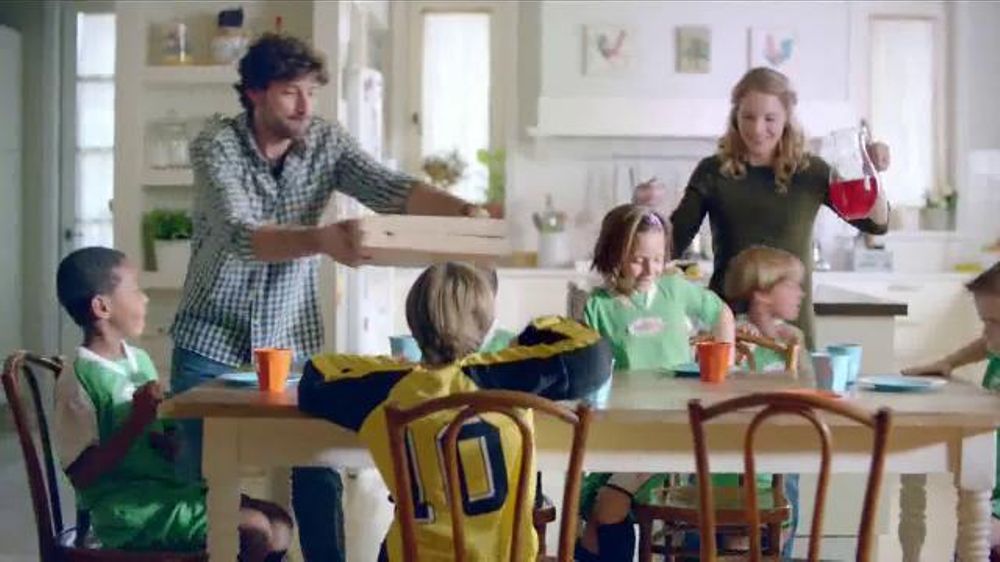
Locate an element on the screen. This screenshot has height=562, width=1000. orange cup is located at coordinates (708, 351).